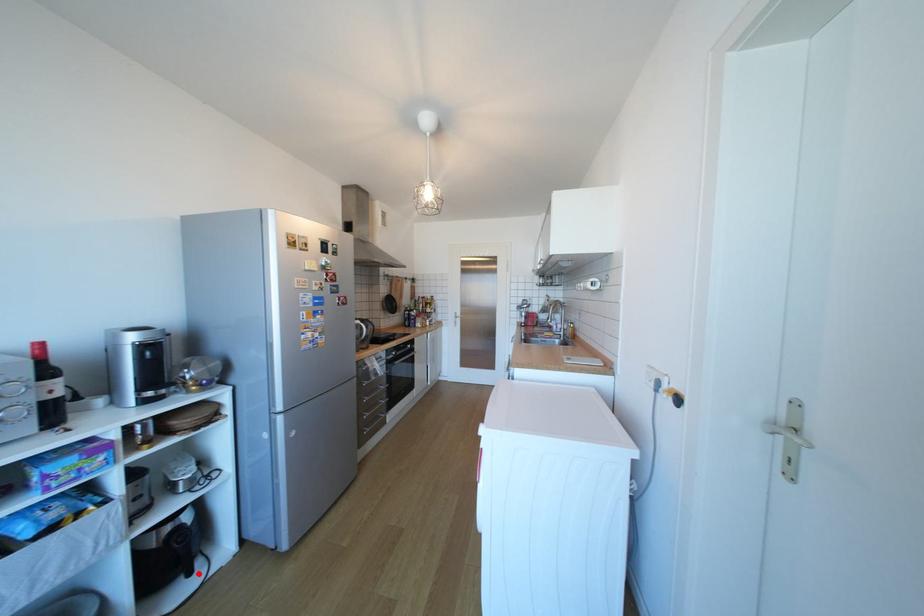
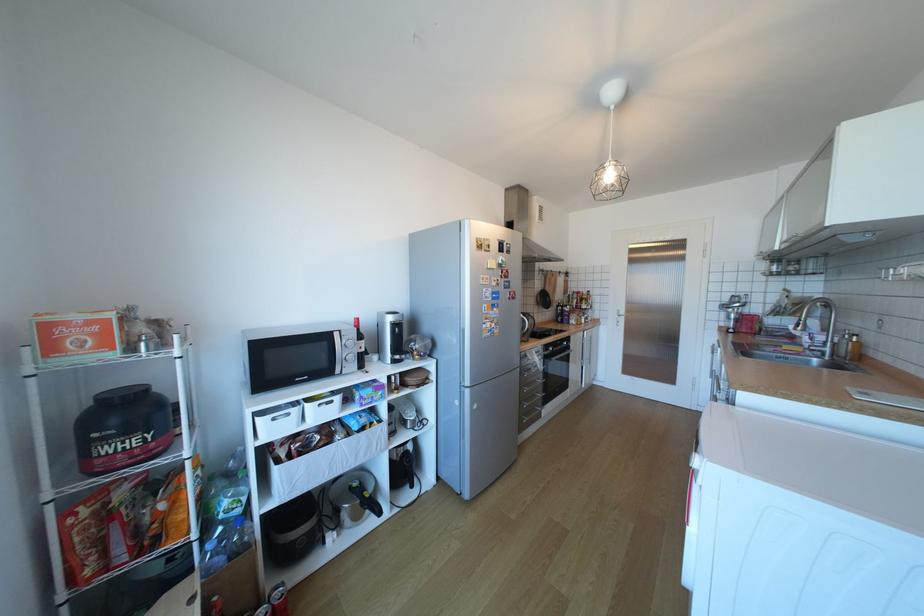
Question: A red point is marked in image1. In image2, is the corresponding 3D point closer to the camera or farther? Reply with the corresponding letter.

Choices:
 (A) The corresponding 3D point is closer.
 (B) The corresponding 3D point is farther.

Answer: (B)